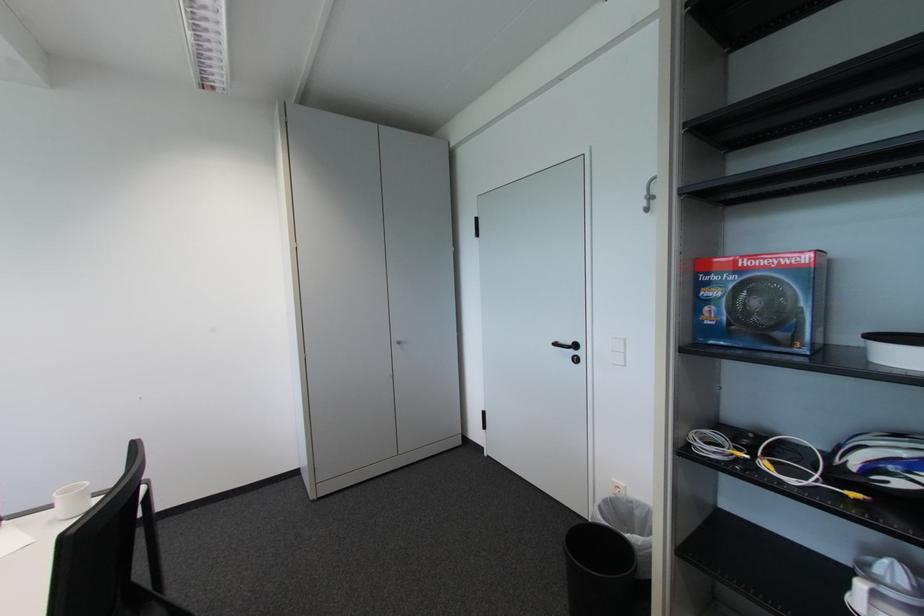
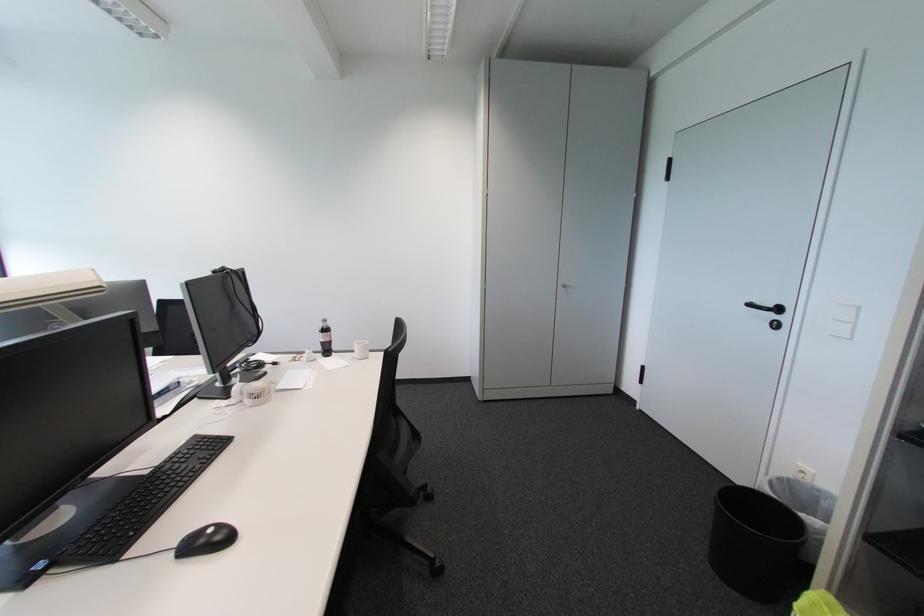
Question: Based on the continuous images, in which direction is the camera rotating? Reply with the corresponding letter.

Choices:
 (A) Left
 (B) Right
 (C) Up
 (D) Down

Answer: (A)